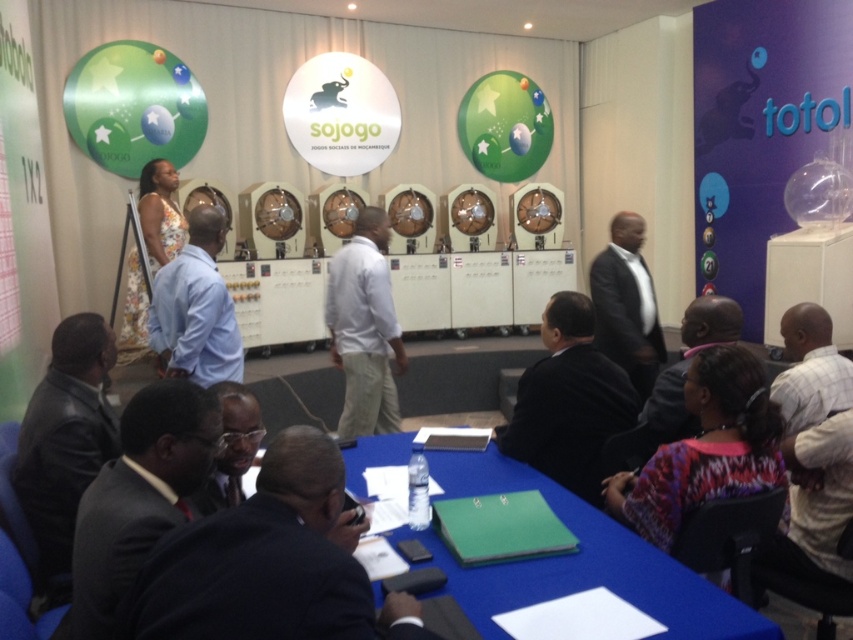
You are a photographer standing at the camera position. You want to take a closeup shot of the dark suit at lower center without moving the subject. Can you do it with a standard zoom lens that has a minimum focusing distance of 0.5 meters?

The dark suit at lower center is 1.00 meters from camera. Since the minimum focusing distance of the standard zoom lens is 0.5 meters, the photographer can take a closeup shot without moving the subject because the distance is within the lens capability.

Please provide the coordinates of the dark suit at lower center in the image. The coordinate system has the origin at the bottom left corner of the image with x and y axes increasing to the right and up respectively.

The dark suit at lower center is located at coordinates point (270, 563).